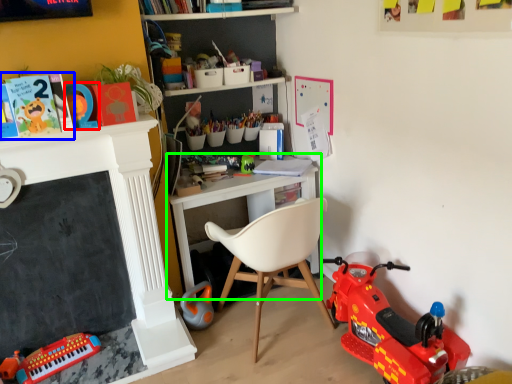
Question: Estimate the real-world distances between objects in this image. Which object is closer to toy (highlighted by a red box), book (highlighted by a blue box) or shelf (highlighted by a green box)?

Choices:
 (A) book
 (B) shelf

Answer: (A)